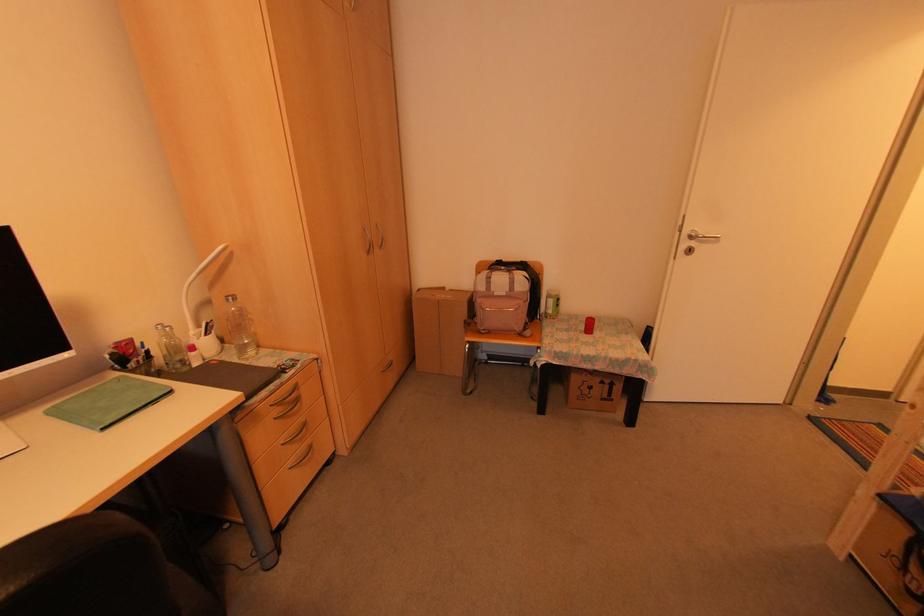
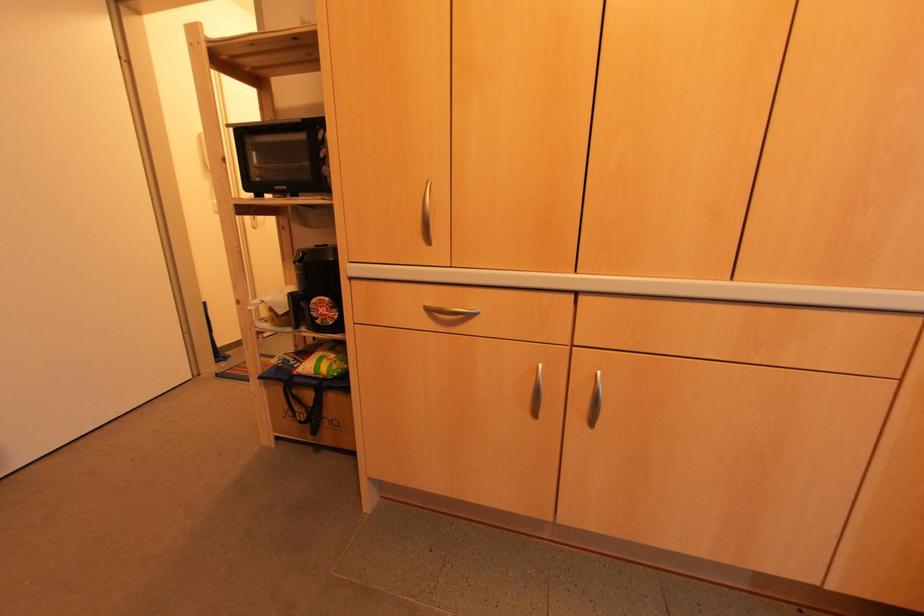
Question: The camera is either moving clockwise (left) or counter-clockwise (right) around the object. The first image is from the beginning of the video and the second image is from the end. Is the camera moving left or right when shooting the video?

Choices:
 (A) Left
 (B) Right

Answer: (A)